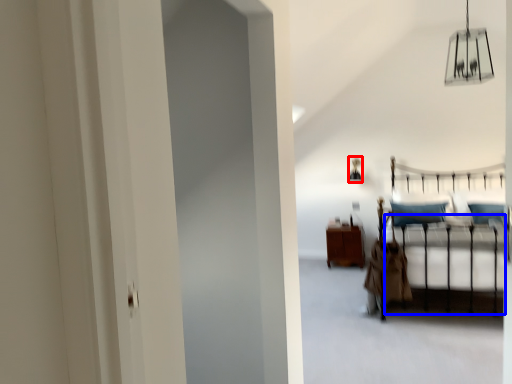
Question: Which object appears closest to the camera in this image, lamp (highlighted by a red box) or bed frame (highlighted by a blue box)?

Choices:
 (A) lamp
 (B) bed frame

Answer: (B)